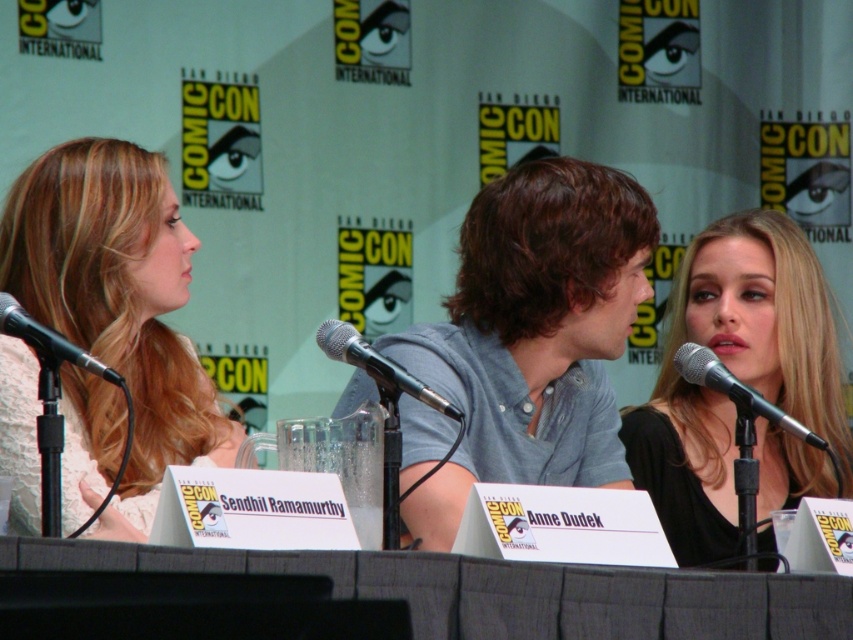
Question: Can you confirm if black matte dress at center is thinner than textured gray table at center?

Choices:
 (A) no
 (B) yes

Answer: (B)

Question: Is textured gray table at center above black metallic microphone at right?

Choices:
 (A) no
 (B) yes

Answer: (A)

Question: Estimate the real-world distances between objects in this image. Which object is closer to the black matte dress at center?

Choices:
 (A) black metallic microphone at right
 (B) light pink lace dress at left

Answer: (B)

Question: Which object is positioned farthest from the textured gray table at center?

Choices:
 (A) light pink lace dress at left
 (B) metallic silver microphone at center
 (C) black metallic microphone at right

Answer: (A)

Question: Among these objects, which one is nearest to the camera?

Choices:
 (A) light pink lace dress at left
 (B) black metallic microphone at right
 (C) black metallic microphone at left
 (D) black matte dress at center

Answer: (C)

Question: Is textured gray table at center bigger than metallic silver microphone at center?

Choices:
 (A) no
 (B) yes

Answer: (B)